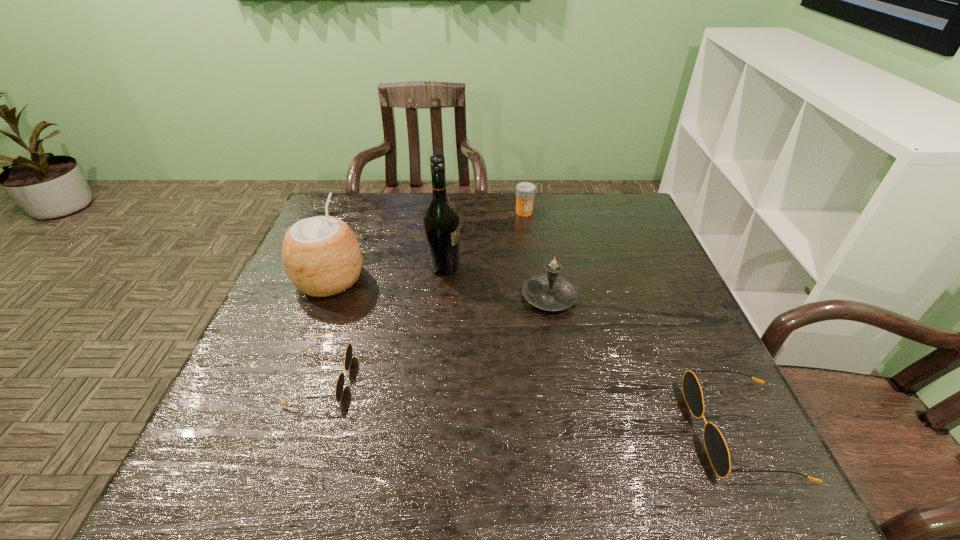
Where is `vacant region between the fifth tallest object and the wine bottle`? This screenshot has height=540, width=960. vacant region between the fifth tallest object and the wine bottle is located at coordinates (592, 349).

In order to click on empty space that is in between the shortest object and the tallest object in this screenshot , I will do `click(382, 322)`.

Find the location of `blank region between the rightmost object and the coconut`. blank region between the rightmost object and the coconut is located at coordinates (536, 355).

Where is `free space between the second tallest object and the candle`? free space between the second tallest object and the candle is located at coordinates (440, 288).

Identify the location of vacant region between the tallest object and the taller sunglasses. This screenshot has width=960, height=540. (592, 349).

This screenshot has height=540, width=960. Find the location of `blank region between the fifth shortest object and the shortest object`. blank region between the fifth shortest object and the shortest object is located at coordinates (325, 329).

Where is `free space between the farthest object and the tallest object`? free space between the farthest object and the tallest object is located at coordinates (484, 239).

Where is `free space between the farthest object and the taller sunglasses`? free space between the farthest object and the taller sunglasses is located at coordinates (633, 321).

You are a GUI agent. You are given a task and a screenshot of the screen. Output one action in this format:
    pyautogui.click(x=<x>, y=<y>)
    Task: Click on the vacant area that lies between the farthest object and the second shortest object
    Image resolution: width=960 pixels, height=540 pixels.
    Given the screenshot: What is the action you would take?
    pyautogui.click(x=633, y=321)

Find the location of a particular element. The height and width of the screenshot is (540, 960). object that stands as the third closest to the wine bottle is located at coordinates pyautogui.click(x=525, y=191).